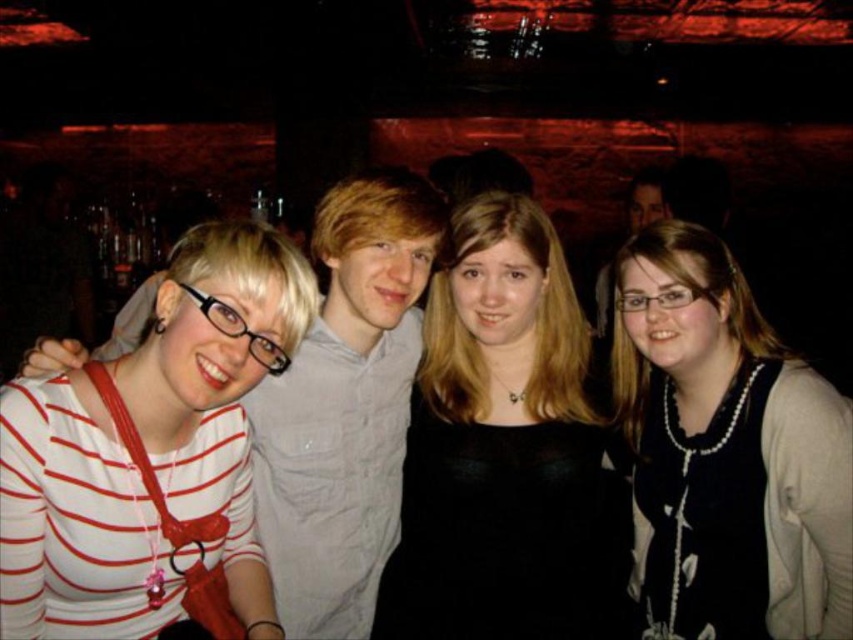
Question: Does pearl necklace at center lie behind white striped shirt at left?

Choices:
 (A) yes
 (B) no

Answer: (A)

Question: Which point appears farthest from the camera in this image?

Choices:
 (A) (44, 620)
 (B) (585, 496)

Answer: (B)

Question: Which of these objects is positioned farthest from the black matte dress at center?

Choices:
 (A) white striped shirt at left
 (B) pearl necklace at center

Answer: (A)

Question: Which point is farther to the camera?

Choices:
 (A) (595, 604)
 (B) (64, 416)

Answer: (A)

Question: Does black matte dress at center appear on the right side of pearl necklace at center?

Choices:
 (A) yes
 (B) no

Answer: (B)

Question: Is pearl necklace at center thinner than white striped shirt at left?

Choices:
 (A) yes
 (B) no

Answer: (A)